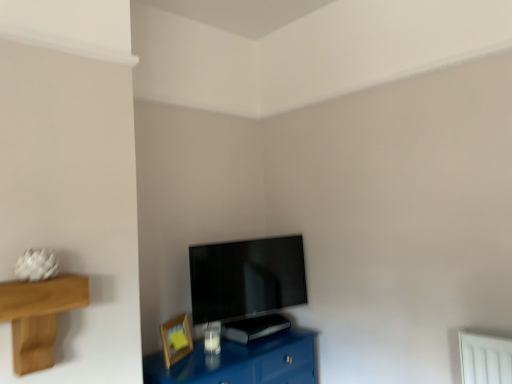
Identify the location of free space in front of wooden picture frame at lower left. (180, 372).